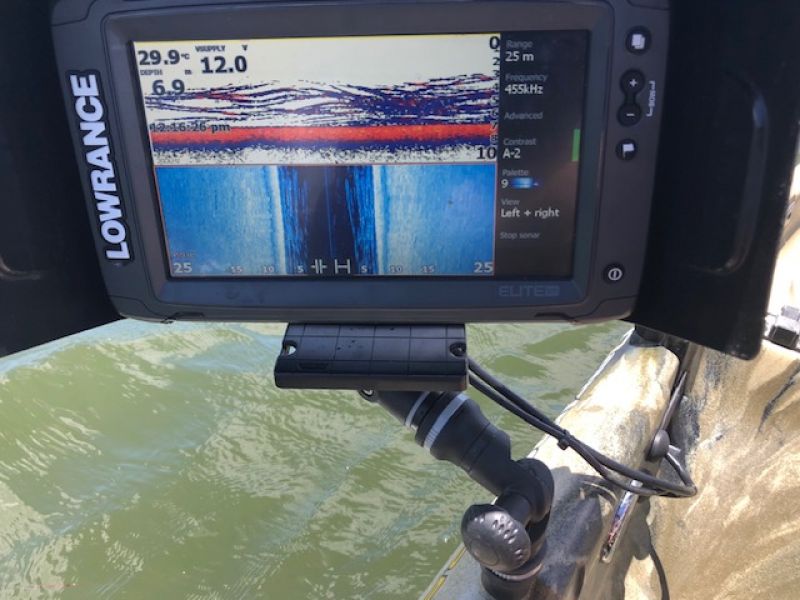
At what (x,y) coordinates should I click in order to perform the action: click on cable. Please return your answer as a coordinate pair (x, y). Looking at the image, I should click on coord(586,448), coord(542,425).